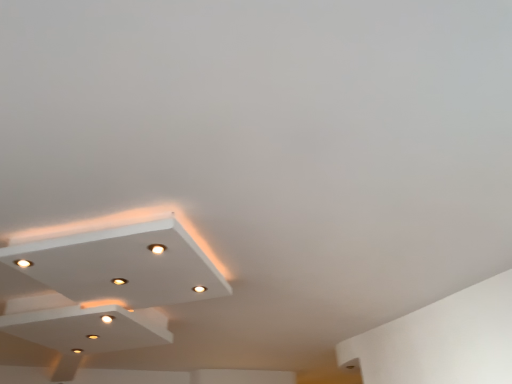
Question: From the image's perspective, relative to matte white light at center, is white matte exhaust hood at lower left above or below?

Choices:
 (A) above
 (B) below

Answer: (B)

Question: From a real-world perspective, is white matte exhaust hood at lower left physically located above or below matte white light at center?

Choices:
 (A) below
 (B) above

Answer: (A)

Question: Which object is positioned closest to the matte white light at center?

Choices:
 (A) white glossy ceiling light at lower left
 (B) matte white droplight at center
 (C) white matte exhaust hood at lower left

Answer: (A)

Question: Based on their relative distances, which object is farther from the white matte exhaust hood at lower left?

Choices:
 (A) matte white light at center
 (B) white glossy ceiling light at lower left
 (C) matte white droplight at center

Answer: (C)